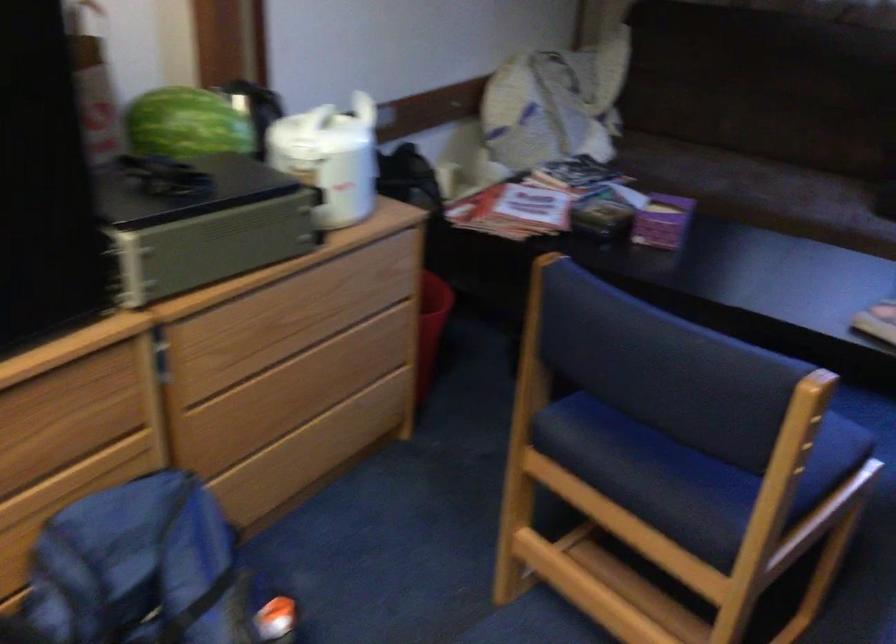
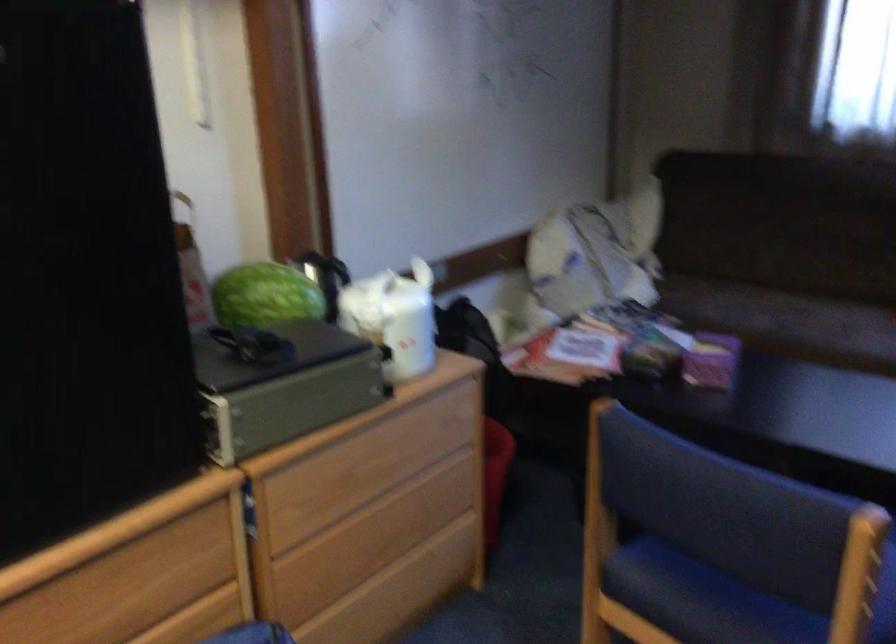
Where in the second image is the point corresponding to point (660, 223) from the first image?

(711, 361)